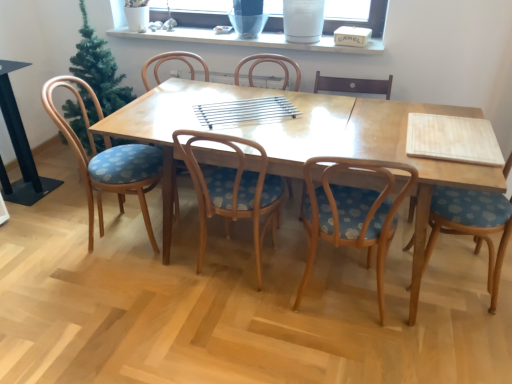
Identify the location of wooden chair with blue floral cushion at center, positioned as the second chair in right-to-left order. (352, 211).

Describe the element at coordinates (106, 160) in the screenshot. The width and height of the screenshot is (512, 384). I see `wooden chair with blue floral cushion at left, acting as the sixth chair starting from the right` at that location.

The image size is (512, 384). In order to click on blue fabric chair at right, the first chair positioned from the right in this screenshot , I will do `click(472, 225)`.

What is the approximate width of wooden chair with blue cushion at center, marked as the third chair in a left-to-right arrangement?

21.28 inches.

Describe the element at coordinates (232, 190) in the screenshot. I see `wooden chair with blue cushion at center, marked as the third chair in a left-to-right arrangement` at that location.

Image resolution: width=512 pixels, height=384 pixels. I want to click on light brown wooden table at center, so click(303, 142).

Who is more distant, blue fabric chair at right, the first chair positioned from the right, or wooden chair with blue floral cushion at left, acting as the sixth chair starting from the right?

wooden chair with blue floral cushion at left, acting as the sixth chair starting from the right, is further away from the camera.

Considering the relative sizes of blue fabric chair at right, the first chair positioned from the right, and wooden chair with blue floral cushion at left, acting as the sixth chair starting from the right, in the image provided, is blue fabric chair at right, the first chair positioned from the right, shorter than wooden chair with blue floral cushion at left, acting as the sixth chair starting from the right,?

Yes, blue fabric chair at right, the first chair positioned from the right, is shorter than wooden chair with blue floral cushion at left, acting as the sixth chair starting from the right.

Does blue fabric chair at right, the 6th chair in the left-to-right sequence, have a lesser width compared to wooden chair with blue floral cushion at left, acting as the sixth chair starting from the right?

Incorrect, the width of blue fabric chair at right, the 6th chair in the left-to-right sequence, is not less than that of wooden chair with blue floral cushion at left, acting as the sixth chair starting from the right.

Can you confirm if blue fabric chair at right, the first chair positioned from the right, is positioned to the left of wooden chair with blue floral cushion at left, acting as the sixth chair starting from the right?

Incorrect, blue fabric chair at right, the first chair positioned from the right, is not on the left side of wooden chair with blue floral cushion at left, acting as the sixth chair starting from the right.

Is blue fabric chair at right, the first chair positioned from the right, at the back of wooden chair with blue patterned seat at center, which is the second chair in left-to-right order?

No, wooden chair with blue patterned seat at center, which is the second chair in left-to-right order,'s orientation is not away from blue fabric chair at right, the first chair positioned from the right.

Is wooden chair with blue patterned seat at center, which is the second chair in left-to-right order, in contact with blue fabric chair at right, the 6th chair in the left-to-right sequence?

They are not placed beside each other.

Who is shorter, wooden chair with blue patterned seat at center, which is the second chair in left-to-right order, or blue fabric chair at right, the first chair positioned from the right?

wooden chair with blue patterned seat at center, which is the second chair in left-to-right order.

Would you say wooden chair with blue cushion at center, marked as the third chair in a left-to-right arrangement, is inside or outside wooden chair with blue patterned seat at center, which is the second chair in left-to-right order?

wooden chair with blue cushion at center, marked as the third chair in a left-to-right arrangement, is located beyond the bounds of wooden chair with blue patterned seat at center, which is the second chair in left-to-right order.

From a real-world perspective, relative to wooden chair with blue patterned seat at center, which is the second chair in left-to-right order, is wooden chair with blue cushion at center, which is counted as the 4th chair, starting from the right, vertically above or below?

In terms of real-world spatial position, wooden chair with blue cushion at center, which is counted as the 4th chair, starting from the right, is above wooden chair with blue patterned seat at center, which is the second chair in left-to-right order.

Is wooden chair with blue cushion at center, which is counted as the 4th chair, starting from the right, wider or thinner than wooden chair with blue patterned seat at center, which is the second chair in left-to-right order?

Clearly, wooden chair with blue cushion at center, which is counted as the 4th chair, starting from the right, has less width compared to wooden chair with blue patterned seat at center, which is the second chair in left-to-right order.

Considering the positions of objects wooden chair with blue cushion at center, which is counted as the 4th chair, starting from the right, and wooden chair with blue patterned seat at center, the 5th chair in the right-to-left sequence, in the image provided, who is more to the right, wooden chair with blue cushion at center, which is counted as the 4th chair, starting from the right, or wooden chair with blue patterned seat at center, the 5th chair in the right-to-left sequence,?

wooden chair with blue cushion at center, which is counted as the 4th chair, starting from the right.

Considering the positions of points (500, 212) and (197, 101), is point (500, 212) closer to camera compared to point (197, 101)?

That is True.

At what (x,y) coordinates should I click in order to perform the action: click on kitchen & dining room table that appears above the blue fabric chair at right, the first chair positioned from the right (from the image's perspective). Please return your answer as a coordinate pair (x, y). Looking at the image, I should click on (303, 142).

Which object is positioned more to the right, blue fabric chair at right, the first chair positioned from the right, or light brown wooden table at center?

blue fabric chair at right, the first chair positioned from the right, is more to the right.

From a real-world perspective, does blue fabric chair at right, the 6th chair in the left-to-right sequence, sit lower than light brown wooden table at center?

Actually, blue fabric chair at right, the 6th chair in the left-to-right sequence, is physically above light brown wooden table at center in the real world.

How much distance is there between wooden chair with floral cushion at center, which appears as the fourth chair when viewed from the left, and wooden chair with blue floral cushion at center, positioned as the second chair in right-to-left order?

wooden chair with floral cushion at center, which appears as the fourth chair when viewed from the left, and wooden chair with blue floral cushion at center, positioned as the second chair in right-to-left order, are 3.84 feet apart from each other.

From a real-world perspective, is wooden chair with floral cushion at center, which appears as the fourth chair when viewed from the left, positioned above or below wooden chair with blue floral cushion at center, positioned as the second chair in right-to-left order?

In terms of real-world spatial position, wooden chair with floral cushion at center, which appears as the fourth chair when viewed from the left, is above wooden chair with blue floral cushion at center, positioned as the second chair in right-to-left order.

From the image's perspective, relative to wooden chair with blue floral cushion at center, positioned as the second chair in right-to-left order, is wooden chair with floral cushion at center, the 3th chair in the right-to-left sequence, above or below?

wooden chair with floral cushion at center, the 3th chair in the right-to-left sequence, is situated higher than wooden chair with blue floral cushion at center, positioned as the second chair in right-to-left order, in the image.

Is wooden chair with blue floral cushion at center, positioned as the second chair in right-to-left order, a part of wooden chair with floral cushion at center, which appears as the fourth chair when viewed from the left?

No.

From a real-world perspective, who is located lower, wooden chair with blue floral cushion at center, positioned as the second chair in right-to-left order, or wooden chair with blue patterned seat at center, which is the second chair in left-to-right order?

From a 3D spatial view, wooden chair with blue floral cushion at center, positioned as the second chair in right-to-left order, is below.

Is the depth of wooden chair with blue floral cushion at center, acting as the 5th chair starting from the left, less than that of wooden chair with blue patterned seat at center, the 5th chair in the right-to-left sequence?

Yes.

Are wooden chair with blue floral cushion at center, positioned as the second chair in right-to-left order, and wooden chair with blue patterned seat at center, which is the second chair in left-to-right order, located far from each other?

Indeed, wooden chair with blue floral cushion at center, positioned as the second chair in right-to-left order, is not near wooden chair with blue patterned seat at center, which is the second chair in left-to-right order.

Does transparent glass window screen at upper center turn towards wooden chair with blue floral cushion at center, acting as the 5th chair starting from the left?

No, transparent glass window screen at upper center is not turned towards wooden chair with blue floral cushion at center, acting as the 5th chair starting from the left.

From the image's perspective, between transparent glass window screen at upper center and wooden chair with blue floral cushion at center, acting as the 5th chair starting from the left, which one is located above?

From the image's view, transparent glass window screen at upper center is above.

Considering the relative sizes of transparent glass window screen at upper center and wooden chair with blue floral cushion at center, acting as the 5th chair starting from the left, in the image provided, is transparent glass window screen at upper center bigger than wooden chair with blue floral cushion at center, acting as the 5th chair starting from the left,?

Actually, transparent glass window screen at upper center might be smaller than wooden chair with blue floral cushion at center, acting as the 5th chair starting from the left.

Is transparent glass window screen at upper center to the left of wooden chair with blue floral cushion at center, acting as the 5th chair starting from the left, from the viewer's perspective?

Indeed, transparent glass window screen at upper center is positioned on the left side of wooden chair with blue floral cushion at center, acting as the 5th chair starting from the left.

From the image's perspective, starting from the wooden chair with blue floral cushion at left, acting as the sixth chair starting from the right, which chair is the 2nd one below? Please provide its 2D coordinates.

[(472, 225)]

You are a GUI agent. You are given a task and a screenshot of the screen. Output one action in this format:
    pyautogui.click(x=<x>, y=<y>)
    Task: Click on the 2nd chair located above the blue fabric chair at right, the first chair positioned from the right (from a real-world perspective)
    
    Given the screenshot: What is the action you would take?
    pyautogui.click(x=172, y=59)

When comparing their distances from wooden chair with blue patterned seat at center, the 5th chair in the right-to-left sequence, does transparent glass window screen at upper center or wooden chair with floral cushion at center, which appears as the fourth chair when viewed from the left, seem closer?

Among the two, transparent glass window screen at upper center is located nearer to wooden chair with blue patterned seat at center, the 5th chair in the right-to-left sequence.

Estimate the real-world distances between objects in this image. Which object is closer to light brown wooden table at center, wooden chair with blue floral cushion at center, positioned as the second chair in right-to-left order, or wooden chair with blue cushion at center, marked as the third chair in a left-to-right arrangement?

wooden chair with blue cushion at center, marked as the third chair in a left-to-right arrangement.

Looking at this image, when comparing their distances from transparent glass window screen at upper center, does wooden chair with blue cushion at center, which is counted as the 4th chair, starting from the right, or wooden chair with blue floral cushion at left, acting as the first chair starting from the left, seem closer?

wooden chair with blue floral cushion at left, acting as the first chair starting from the left.

When comparing their distances from wooden chair with blue floral cushion at left, acting as the sixth chair starting from the right, does white ceramic vase at upper center or wooden chair with blue floral cushion at center, positioned as the second chair in right-to-left order, seem closer?

wooden chair with blue floral cushion at center, positioned as the second chair in right-to-left order.

Looking at the image, which one is located closer to white ceramic vase at upper center, wooden chair with blue floral cushion at left, acting as the sixth chair starting from the right, or wooden chair with blue cushion at center, marked as the third chair in a left-to-right arrangement?

Based on the image, wooden chair with blue floral cushion at left, acting as the sixth chair starting from the right, appears to be nearer to white ceramic vase at upper center.

Considering their positions, is wooden chair with blue patterned seat at center, the 5th chair in the right-to-left sequence, positioned further to light brown wooden table at center than white ceramic vase at upper center?

The object further to light brown wooden table at center is wooden chair with blue patterned seat at center, the 5th chair in the right-to-left sequence.

Looking at the image, which one is located further to wooden chair with blue floral cushion at center, acting as the 5th chair starting from the left, light brown wooden table at center or wooden chair with blue floral cushion at left, acting as the sixth chair starting from the right?

Based on the image, wooden chair with blue floral cushion at left, acting as the sixth chair starting from the right, appears to be further to wooden chair with blue floral cushion at center, acting as the 5th chair starting from the left.

Considering their positions, is white ceramic vase at upper center positioned closer to transparent glass window screen at upper center than blue fabric chair at right, the first chair positioned from the right?

Among the two, white ceramic vase at upper center is located nearer to transparent glass window screen at upper center.

Identify the location of window sill situated between wooden chair with blue floral cushion at left, acting as the sixth chair starting from the right, and blue fabric chair at right, the 6th chair in the left-to-right sequence, from left to right. This screenshot has height=384, width=512. (249, 40).

Locate an element on the screen. The image size is (512, 384). kitchen & dining room table between white ceramic vase at upper center and wooden chair with blue cushion at center, which is counted as the 4th chair, starting from the right, in the up-down direction is located at coordinates (303, 142).

Identify the location of kitchen & dining room table situated between wooden chair with blue cushion at center, marked as the third chair in a left-to-right arrangement, and blue fabric chair at right, the first chair positioned from the right, from left to right. (303, 142).

I want to click on chair between wooden chair with blue floral cushion at left, acting as the first chair starting from the left, and wooden chair with blue cushion at center, which is counted as the 4th chair, starting from the right, from left to right, so click(x=172, y=59).